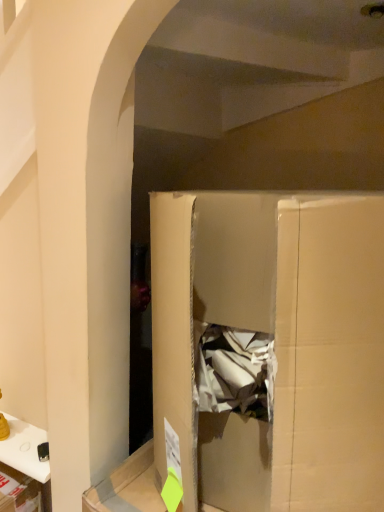
Question: From the image's perspective, is cardboard box at center under white glossy phone at lower left?

Choices:
 (A) yes
 (B) no

Answer: (B)

Question: Does cardboard box at center have a lesser width compared to white glossy phone at lower left?

Choices:
 (A) no
 (B) yes

Answer: (A)

Question: Is cardboard box at center facing towards white glossy phone at lower left?

Choices:
 (A) no
 (B) yes

Answer: (A)

Question: Considering the relative sizes of cardboard box at center and white glossy phone at lower left in the image provided, is cardboard box at center shorter than white glossy phone at lower left?

Choices:
 (A) no
 (B) yes

Answer: (A)

Question: Does cardboard box at center have a smaller size compared to white glossy phone at lower left?

Choices:
 (A) yes
 (B) no

Answer: (B)

Question: From a real-world perspective, does cardboard box at center sit lower than white glossy phone at lower left?

Choices:
 (A) no
 (B) yes

Answer: (A)

Question: Considering the relative sizes of white glossy phone at lower left and cardboard box at center in the image provided, is white glossy phone at lower left taller than cardboard box at center?

Choices:
 (A) no
 (B) yes

Answer: (A)

Question: Does white glossy phone at lower left lie in front of cardboard box at center?

Choices:
 (A) no
 (B) yes

Answer: (A)

Question: Is white glossy phone at lower left smaller than cardboard box at center?

Choices:
 (A) yes
 (B) no

Answer: (A)

Question: Is white glossy phone at lower left at the right side of cardboard box at center?

Choices:
 (A) no
 (B) yes

Answer: (A)

Question: From the image's perspective, is white glossy phone at lower left on cardboard box at center?

Choices:
 (A) yes
 (B) no

Answer: (B)

Question: From a real-world perspective, is white glossy phone at lower left positioned under cardboard box at center based on gravity?

Choices:
 (A) no
 (B) yes

Answer: (B)

Question: Is cardboard box at center inside or outside of white glossy phone at lower left?

Choices:
 (A) inside
 (B) outside

Answer: (B)